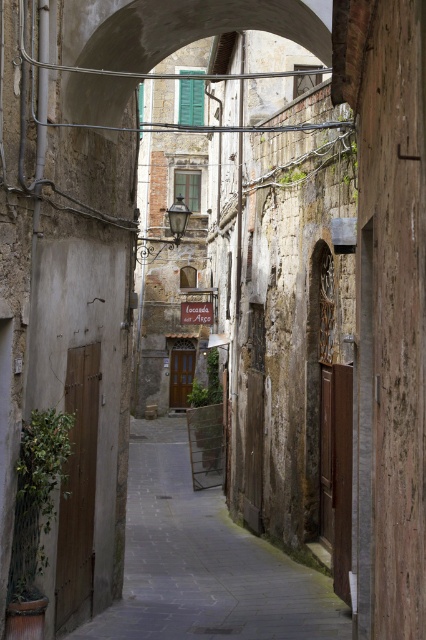
Question: Does smooth stone path at center have a lesser width compared to smooth stone arch at center?

Choices:
 (A) yes
 (B) no

Answer: (B)

Question: Is smooth stone path at center above smooth stone arch at center?

Choices:
 (A) no
 (B) yes

Answer: (A)

Question: Is smooth stone path at center below smooth stone arch at center?

Choices:
 (A) yes
 (B) no

Answer: (A)